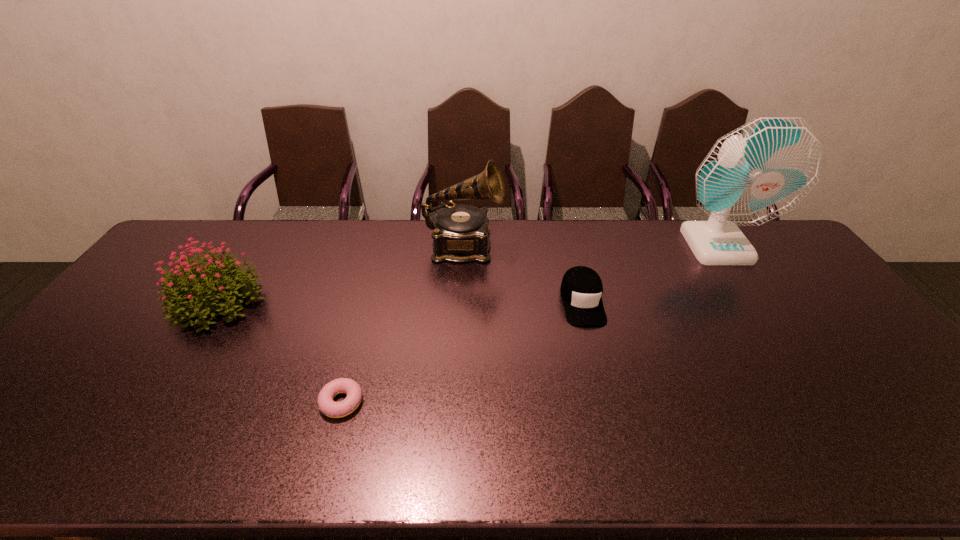
Find the location of a particular element. This screenshot has height=540, width=960. the rightmost object is located at coordinates (763, 169).

Where is `fan`? Image resolution: width=960 pixels, height=540 pixels. fan is located at coordinates (763, 169).

Identify the location of the third object from right to left. The width and height of the screenshot is (960, 540). (460, 234).

Locate an element on the screen. the fourth shortest object is located at coordinates (460, 234).

What are the coordinates of `the leftmost object` in the screenshot? It's located at (188, 290).

I want to click on the third tallest object, so click(188, 290).

Find the location of a particular element. This screenshot has height=540, width=960. the fourth tallest object is located at coordinates (581, 289).

Locate an element on the screen. the fourth object from left to right is located at coordinates (581, 289).

I want to click on the fourth object from right to left, so click(x=326, y=404).

What are the coordinates of `the nearest object` in the screenshot? It's located at (326, 404).